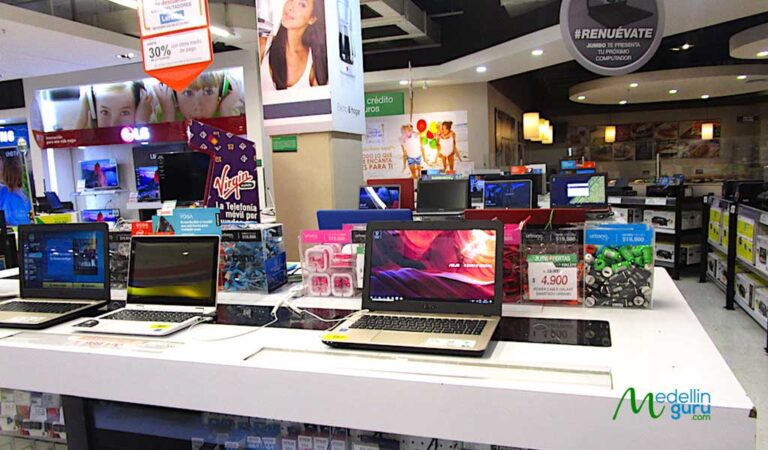
The image size is (768, 450). In order to click on floor in this screenshot , I will do `click(730, 341)`.